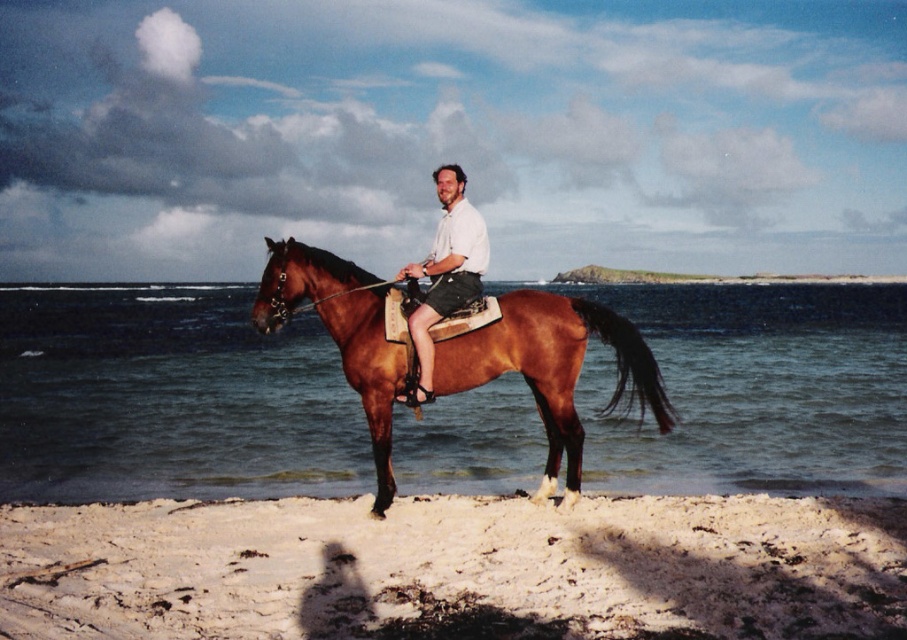
Does brown glossy water at center appear under shiny brown horse at center?

Actually, brown glossy water at center is above shiny brown horse at center.

Is brown glossy water at center behind shiny brown horse at center?

That is True.

This screenshot has height=640, width=907. What do you see at coordinates (169, 397) in the screenshot? I see `brown glossy water at center` at bounding box center [169, 397].

Locate an element on the screen. The height and width of the screenshot is (640, 907). brown glossy water at center is located at coordinates coord(169,397).

Between point (795, 291) and point (2, 625), which one is positioned in front?

Point (2, 625) is in front.

Can you confirm if brown glossy water at center is positioned to the left of white sandy beach at lower center?

Correct, you'll find brown glossy water at center to the left of white sandy beach at lower center.

Does point (21, 445) come behind point (139, 586)?

That is True.

Image resolution: width=907 pixels, height=640 pixels. In order to click on brown glossy water at center in this screenshot , I will do `click(169, 397)`.

Is point (71, 426) positioned in front of point (467, 228)?

No, (71, 426) is behind (467, 228).

Which is above, brown glossy water at center or matte white shirt at center?

brown glossy water at center is above.

Between point (265, 412) and point (428, 275), which one is positioned behind?

Point (265, 412)

This screenshot has width=907, height=640. I want to click on brown glossy water at center, so click(169, 397).